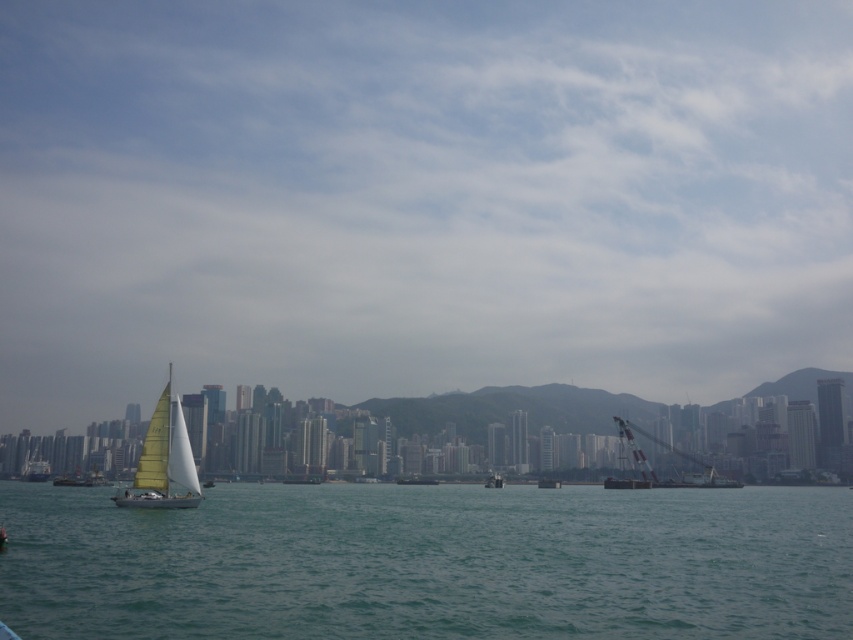
Based on the photo, between green water at lower left and white plastic crane at right, which one appears on the right side from the viewer's perspective?

white plastic crane at right

Does green water at lower left have a lesser width compared to white plastic crane at right?

No, green water at lower left is not thinner than white plastic crane at right.

You are a GUI agent. You are given a task and a screenshot of the screen. Output one action in this format:
    pyautogui.click(x=<x>, y=<y>)
    Task: Click on the green water at lower left
    Image resolution: width=853 pixels, height=640 pixels.
    Given the screenshot: What is the action you would take?
    pyautogui.click(x=428, y=563)

Where is `green water at lower left`? This screenshot has height=640, width=853. green water at lower left is located at coordinates click(x=428, y=563).

What are the coordinates of `transparent glass sailboat at lower left` in the screenshot? It's located at (418, 198).

Is transparent glass sailboat at lower left to the right of green water at lower left from the viewer's perspective?

Incorrect, transparent glass sailboat at lower left is not on the right side of green water at lower left.

Between point (61, 272) and point (328, 566), which one is positioned in front?

Point (328, 566) is more forward.

At what (x,y) coordinates should I click in order to perform the action: click on transparent glass sailboat at lower left. Please return your answer as a coordinate pair (x, y). Looking at the image, I should click on (418, 198).

Does transparent glass sailboat at lower left have a smaller size compared to yellow matte sailboat at left?

No.

Is point (120, 51) behind point (154, 464)?

Yes.

This screenshot has width=853, height=640. Identify the location of transparent glass sailboat at lower left. (418, 198).